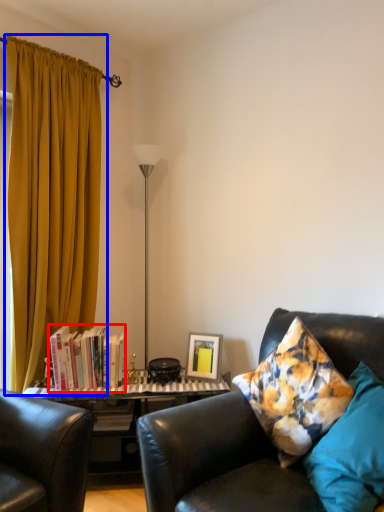
Question: Among these objects, which one is farthest to the camera, book (highlighted by a red box) or curtain (highlighted by a blue box)?

Choices:
 (A) book
 (B) curtain

Answer: (A)